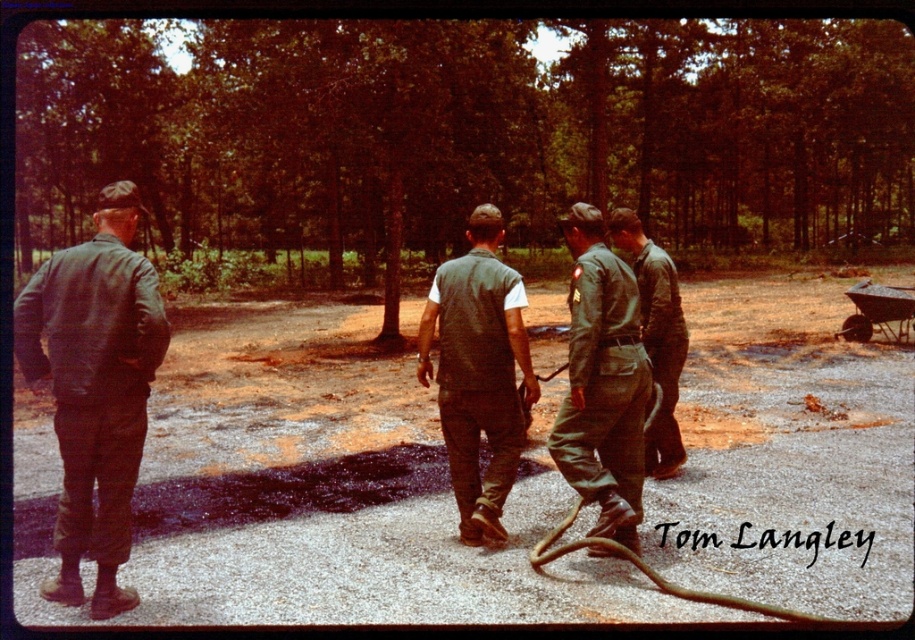
Question: Where is green fabric vest at center located in relation to green matte uniform at center in the image?

Choices:
 (A) below
 (B) above

Answer: (A)

Question: Which of the following is the closest to the observer?

Choices:
 (A) green uniform at center
 (B) green matte uniform at center
 (C) matte green jacket at left
 (D) green fabric vest at center

Answer: (C)

Question: Which object is positioned closest to the green uniform at center?

Choices:
 (A) matte green jacket at left
 (B) green matte uniform at center
 (C) green fabric vest at center

Answer: (C)

Question: Can you confirm if green fabric vest at center is positioned to the left of green matte uniform at center?

Choices:
 (A) yes
 (B) no

Answer: (A)

Question: Which object appears farthest from the camera in this image?

Choices:
 (A) green matte uniform at center
 (B) green uniform at center
 (C) green fabric vest at center
 (D) matte green jacket at left

Answer: (A)

Question: Is the position of matte green jacket at left more distant than that of green matte uniform at center?

Choices:
 (A) yes
 (B) no

Answer: (B)